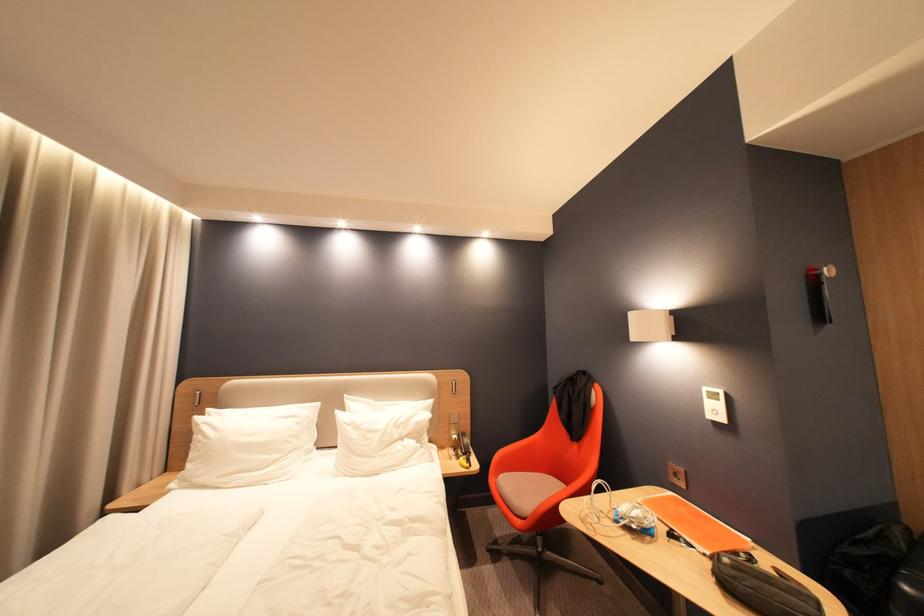
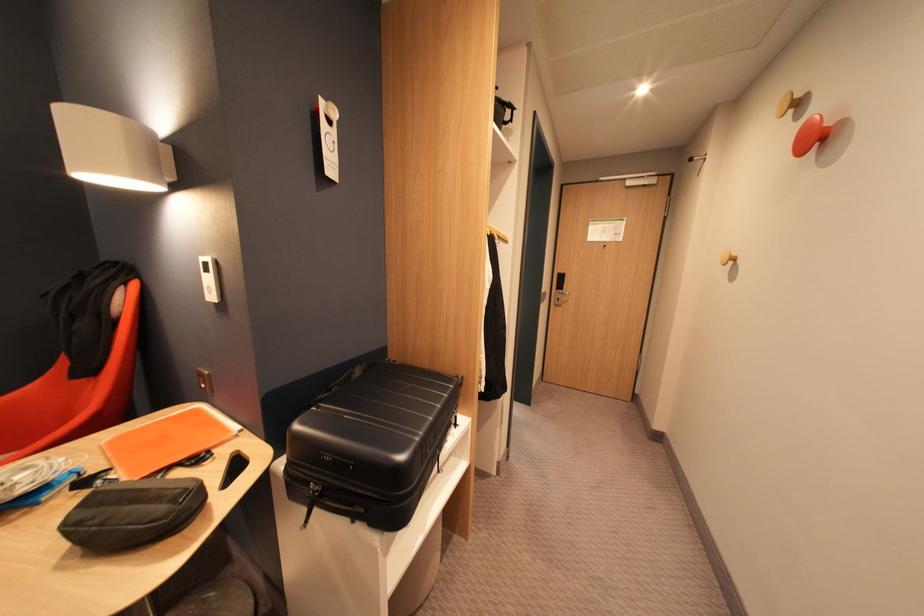
In the second image, find the point that corresponds to [675,493] in the first image.

(195, 410)